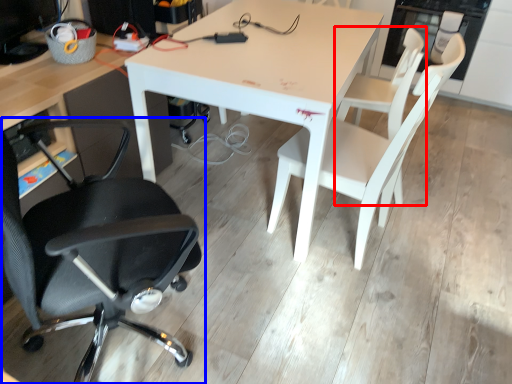
Question: Which object appears farthest to the camera in this image, chair (highlighted by a red box) or chair (highlighted by a blue box)?

Choices:
 (A) chair
 (B) chair

Answer: (A)